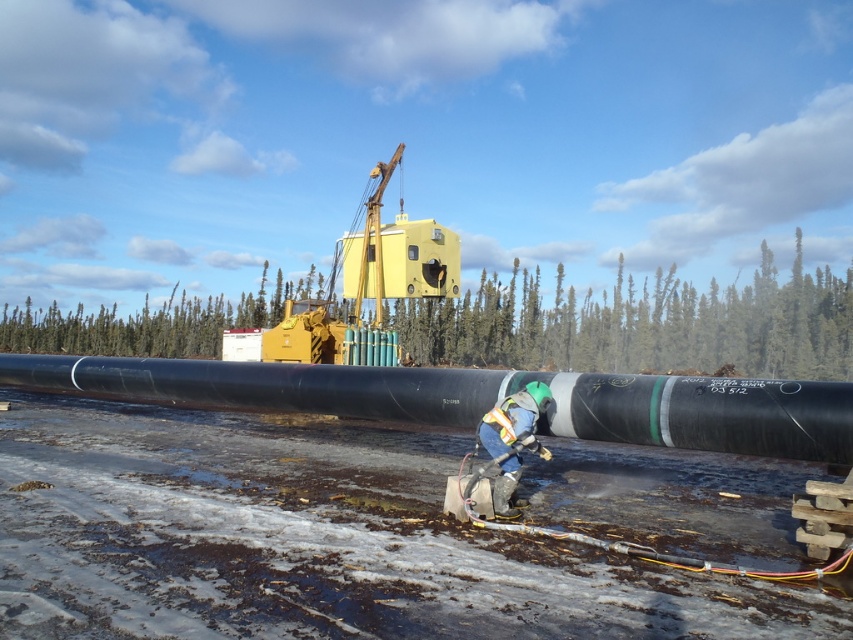
You are a worker standing near the black rubber pipe at center. Your supervisor asks you to measure the distance between the pipe and the nearest snow patch. Can you estimate how far you are from the pipe?

The black rubber pipe at center and viewer are 4.90 meters apart, so you are approximately 4.90 meters away from the pipe.

You are a construction worker who needs to place a tool on the black rubber pipe at center without blocking the reflective silver helmet at center. Where should you place the tool?

The black rubber pipe at center is positioned on the left side of the reflective silver helmet at center, so placing the tool on the left side of the black rubber pipe at center would avoid blocking the helmet.

You are a safety inspector evaluating the construction site. You notice the black rubber pipe at center and the reflective silver helmet at center. Which object should you prioritize inspecting for potential hazards, considering their size and visibility?

The black rubber pipe at center is larger in size than the reflective silver helmet at center, so the larger size of the black rubber pipe at center may pose a greater hazard if not secured properly. Therefore, prioritize inspecting the black rubber pipe at center first.